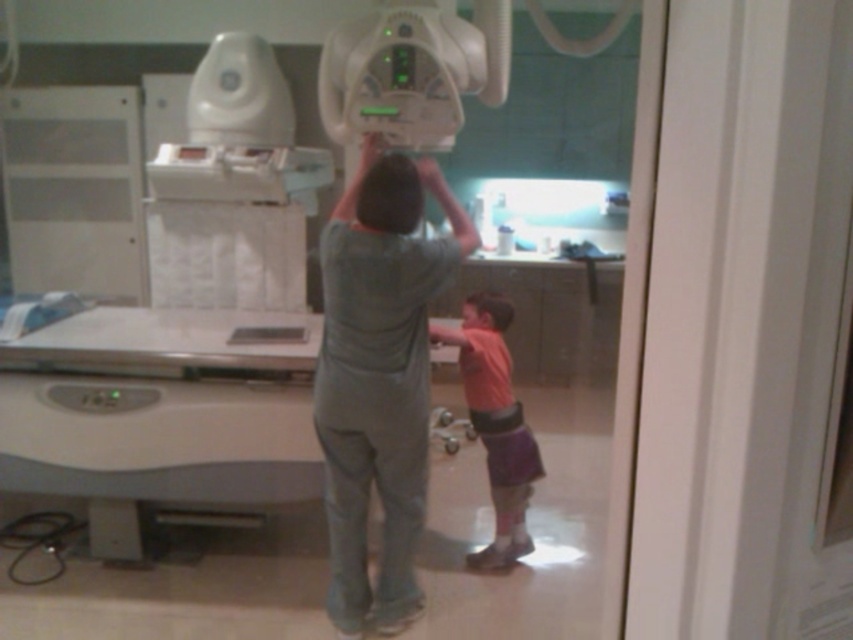
Does point (350, 419) come behind point (361, 179)?

No, (350, 419) is in front of (361, 179).

Which of these two, gray matte uniform at center or matte gray head at center, stands taller?

gray matte uniform at center is taller.

At what (x,y) coordinates should I click in order to perform the action: click on gray matte uniform at center. Please return your answer as a coordinate pair (x, y). The width and height of the screenshot is (853, 640). Looking at the image, I should click on [x=379, y=378].

Locate an element on the screen. The height and width of the screenshot is (640, 853). gray matte uniform at center is located at coordinates (379, 378).

Can you confirm if gray matte uniform at center is shorter than pink fabric head at lower center?

No, gray matte uniform at center is not shorter than pink fabric head at lower center.

Based on the photo, who is more forward, (x=345, y=310) or (x=498, y=323)?

Positioned in front is point (x=345, y=310).

Describe the element at coordinates (379, 378) in the screenshot. I see `gray matte uniform at center` at that location.

Identify the location of gray matte uniform at center. (379, 378).

Who is positioned more to the left, pink fabric at lower right or pink fabric head at lower center?

pink fabric at lower right is more to the left.

Can you confirm if pink fabric at lower right is positioned below pink fabric head at lower center?

Yes.

Between point (506, 397) and point (502, 324), which one is positioned in front?

Point (506, 397)

Identify the location of pink fabric at lower right. (495, 422).